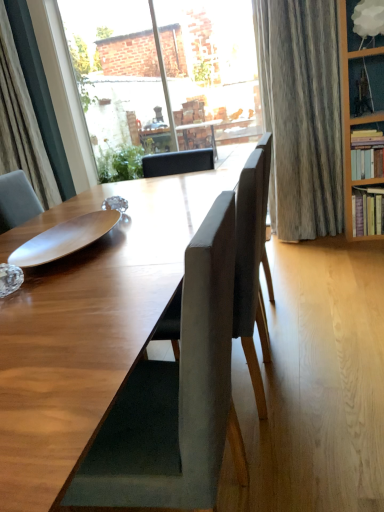
How much space does white cloud lampshade at upper right, which is the first shelf from top to bottom, occupy vertically?

white cloud lampshade at upper right, which is the first shelf from top to bottom, is 12.62 inches tall.

Measure the distance between clear glass window at upper center and camera.

clear glass window at upper center is 12.07 feet away from camera.

Measure the distance between point (129,30) and camera.

3.85 meters.

Where is `hardcover books at right, which is the 3th shelf in top-to-bottom order`? The image size is (384, 512). hardcover books at right, which is the 3th shelf in top-to-bottom order is located at coordinates (367, 211).

In terms of height, does hardwood bookshelf at right, which appears as the second shelf when ordered from the bottom, look taller or shorter compared to suede-like gray chair at center, marked as the 1th chair in a back-to-front arrangement?

Considering their sizes, hardwood bookshelf at right, which appears as the second shelf when ordered from the bottom, has less height than suede-like gray chair at center, marked as the 1th chair in a back-to-front arrangement.

How many degrees apart are the facing directions of hardwood bookshelf at right, which appears as the second shelf when ordered from the bottom, and suede-like gray chair at center, marked as the 1th chair in a back-to-front arrangement?

90.4 degrees.

Is hardwood bookshelf at right, the 2th shelf when ordered from top to bottom, looking in the opposite direction of suede-like gray chair at center, marked as the 1th chair in a back-to-front arrangement?

No.

Is hardwood bookshelf at right, which appears as the second shelf when ordered from the bottom, at the right side of suede-like gray chair at center, marked as the 1th chair in a back-to-front arrangement?

Indeed, hardwood bookshelf at right, which appears as the second shelf when ordered from the bottom, is positioned on the right side of suede-like gray chair at center, marked as the 1th chair in a back-to-front arrangement.

From a real-world perspective, is hardwood bookshelf at right, the 2th shelf when ordered from top to bottom, physically located above or below hardcover books at right, which is the 3th shelf in top-to-bottom order?

In terms of real-world spatial position, hardwood bookshelf at right, the 2th shelf when ordered from top to bottom, is above hardcover books at right, which is the 3th shelf in top-to-bottom order.

Is point (363, 174) closer to viewer compared to point (374, 208)?

No, it is behind (374, 208).

Considering the sizes of objects hardwood bookshelf at right, the 2th shelf when ordered from top to bottom, and hardcover books at right, which is the 3th shelf in top-to-bottom order, in the image provided, who is taller, hardwood bookshelf at right, the 2th shelf when ordered from top to bottom, or hardcover books at right, which is the 3th shelf in top-to-bottom order,?

hardcover books at right, which is the 3th shelf in top-to-bottom order.

Is green leafy plant at center oriented towards clear glass window at upper center?

No, green leafy plant at center is not turned towards clear glass window at upper center.

Considering the positions of objects green leafy plant at center and clear glass window at upper center in the image provided, who is more to the left, green leafy plant at center or clear glass window at upper center?

green leafy plant at center is more to the left.

Consider the image. Does green leafy plant at center have a lesser height compared to clear glass window at upper center?

Correct, green leafy plant at center is not as tall as clear glass window at upper center.

The height and width of the screenshot is (512, 384). Find the location of `plant behind the clear glass window at upper center`. plant behind the clear glass window at upper center is located at coordinates (120, 163).

Between hardwood bookshelf at right, the 2th shelf when ordered from top to bottom, and matte gray chair at center, acting as the 1th chair starting from the front, which one appears on the left side from the viewer's perspective?

Positioned to the left is matte gray chair at center, acting as the 1th chair starting from the front.

Could you tell me if hardwood bookshelf at right, the 2th shelf when ordered from top to bottom, is facing matte gray chair at center, acting as the 1th chair starting from the front?

No, hardwood bookshelf at right, the 2th shelf when ordered from top to bottom, is not oriented towards matte gray chair at center, acting as the 1th chair starting from the front.

Is hardwood bookshelf at right, the 2th shelf when ordered from top to bottom, taller or shorter than matte gray chair at center, which is the 2th chair from back to front?

In the image, hardwood bookshelf at right, the 2th shelf when ordered from top to bottom, appears to be shorter than matte gray chair at center, which is the 2th chair from back to front.

Which is closer, (378, 42) or (368, 215)?

The point (378, 42) is closer to the camera.

Is hardcover books at right, the 1th shelf from the bottom, inside white cloud lampshade at upper right, which is the first shelf from top to bottom?

No.

Consider the image. Is the depth of white cloud lampshade at upper right, which is the first shelf from top to bottom, less than that of hardcover books at right, the 1th shelf from the bottom?

Yes, white cloud lampshade at upper right, which is the first shelf from top to bottom, is in front of hardcover books at right, the 1th shelf from the bottom.

From the image's perspective, is hardcover books at right, the 1th shelf from the bottom, above matte gray chair at center, acting as the 1th chair starting from the front?

Indeed, from the image's perspective, hardcover books at right, the 1th shelf from the bottom, is shown above matte gray chair at center, acting as the 1th chair starting from the front.

You are a GUI agent. You are given a task and a screenshot of the screen. Output one action in this format:
    pyautogui.click(x=<x>, y=<y>)
    Task: Click on the 2nd chair to the left of the hardcover books at right, the 1th shelf from the bottom, starting your count from the anchor
    The height and width of the screenshot is (512, 384).
    Given the screenshot: What is the action you would take?
    pyautogui.click(x=175, y=398)

Does point (375, 202) lie behind point (172, 384)?

Yes, it is.

Between hardcover books at right, the 1th shelf from the bottom, and matte gray chair at center, which is the 2th chair from back to front, which one has larger size?

matte gray chair at center, which is the 2th chair from back to front, is bigger.

Is hardwood bookshelf at right, which appears as the second shelf when ordered from the bottom, at the right side of white cloud lampshade at upper right, which is the first shelf from top to bottom?

Yes, hardwood bookshelf at right, which appears as the second shelf when ordered from the bottom, is to the right of white cloud lampshade at upper right, which is the first shelf from top to bottom.

Looking at the image, does hardwood bookshelf at right, which appears as the second shelf when ordered from the bottom, seem bigger or smaller compared to white cloud lampshade at upper right, marked as the 3th shelf in a bottom-to-top arrangement?

hardwood bookshelf at right, which appears as the second shelf when ordered from the bottom, is smaller than white cloud lampshade at upper right, marked as the 3th shelf in a bottom-to-top arrangement.

Does point (372, 149) come farther from viewer compared to point (357, 1)?

That is True.

From a real-world perspective, count 1st chairs downward from the hardwood bookshelf at right, which appears as the second shelf when ordered from the bottom, and point to it. Please provide its 2D coordinates.

[(251, 270)]

The height and width of the screenshot is (512, 384). What are the coordinates of `shelf that is the 1st object to the left of the hardcover books at right, the 1th shelf from the bottom, starting at the anchor` in the screenshot? It's located at (367, 153).

Which object lies further to the anchor point suede-like gray chair at center, which ranks as the second chair in front-to-back order, matte gray chair at center, which is the 2th chair from back to front, or hardcover books at right, the 1th shelf from the bottom?

The object further to suede-like gray chair at center, which ranks as the second chair in front-to-back order, is hardcover books at right, the 1th shelf from the bottom.

When comparing their distances from green leafy plant at center, does suede-like gray chair at center, which ranks as the second chair in front-to-back order, or hardwood bookshelf at right, which appears as the second shelf when ordered from the bottom, seem further?

suede-like gray chair at center, which ranks as the second chair in front-to-back order, is positioned further to the anchor green leafy plant at center.

Which object lies further to the anchor point wooden plate at center, matte gray chair at center, which is the 2th chair from back to front, or clear glass window at upper center?

clear glass window at upper center lies further to wooden plate at center than the other object.

When comparing their distances from green leafy plant at center, does wooden plate at center or hardwood bookshelf at right, which appears as the second shelf when ordered from the bottom, seem further?

Among the two, wooden plate at center is located further to green leafy plant at center.

Estimate the real-world distances between objects in this image. Which object is closer to clear glass window at upper center, hardcover books at right, the 1th shelf from the bottom, or green leafy plant at center?

green leafy plant at center lies closer to clear glass window at upper center than the other object.

Estimate the real-world distances between objects in this image. Which object is closer to green leafy plant at center, hardcover books at right, the 1th shelf from the bottom, or matte gray chair at center, which is the 2th chair from back to front?

hardcover books at right, the 1th shelf from the bottom, is closer to green leafy plant at center.

Based on their spatial positions, is suede-like gray chair at center, marked as the 1th chair in a back-to-front arrangement, or wooden plate at center closer to matte gray chair at center, which is the 2th chair from back to front?

Among the two, suede-like gray chair at center, marked as the 1th chair in a back-to-front arrangement, is located nearer to matte gray chair at center, which is the 2th chair from back to front.

Based on their spatial positions, is hardcover books at right, the 1th shelf from the bottom, or clear glass window at upper center closer to matte gray chair at center, which is the 2th chair from back to front?

hardcover books at right, the 1th shelf from the bottom, is positioned closer to the anchor matte gray chair at center, which is the 2th chair from back to front.

I want to click on chair between matte gray chair at center, acting as the 1th chair starting from the front, and hardcover books at right, the 1th shelf from the bottom, along the z-axis, so click(x=251, y=270).

The width and height of the screenshot is (384, 512). I want to click on shelf between clear glass window at upper center and hardwood bookshelf at right, which appears as the second shelf when ordered from the bottom, in the horizontal direction, so click(x=352, y=26).

Image resolution: width=384 pixels, height=512 pixels. Find the location of `shelf between matte gray chair at center, which is the 2th chair from back to front, and hardwood bookshelf at right, which appears as the second shelf when ordered from the bottom, from front to back`. shelf between matte gray chair at center, which is the 2th chair from back to front, and hardwood bookshelf at right, which appears as the second shelf when ordered from the bottom, from front to back is located at coordinates (352, 26).

Where is `window between green leafy plant at center and white cloud lampshade at upper right, which is the first shelf from top to bottom, in the horizontal direction`? The height and width of the screenshot is (512, 384). window between green leafy plant at center and white cloud lampshade at upper right, which is the first shelf from top to bottom, in the horizontal direction is located at coordinates (211, 69).